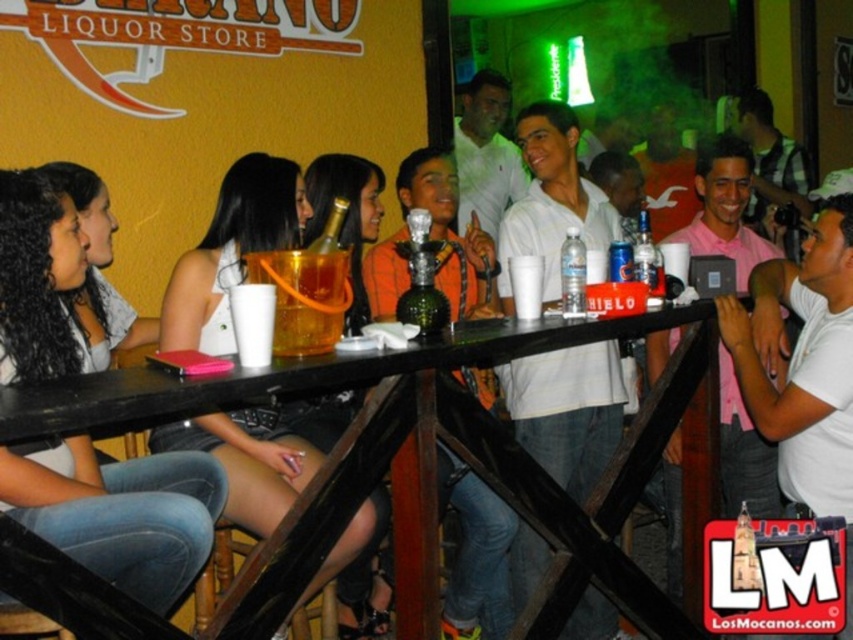
How far apart are translucent plastic cup at center and clear plastic bottle at bar center?

translucent plastic cup at center is 27.66 inches from clear plastic bottle at bar center.

Can you confirm if translucent plastic cup at center is shorter than clear plastic bottle at bar center?

No, translucent plastic cup at center is not shorter than clear plastic bottle at bar center.

What do you see at coordinates (305, 298) in the screenshot?
I see `translucent plastic cup at center` at bounding box center [305, 298].

Image resolution: width=853 pixels, height=640 pixels. Identify the location of translucent plastic cup at center. (305, 298).

Is white matte shirt at center bigger than clear plastic bottle at bar center?

Correct, white matte shirt at center is larger in size than clear plastic bottle at bar center.

Between white matte shirt at center and clear plastic bottle at bar center, which one appears on the left side from the viewer's perspective?

clear plastic bottle at bar center is more to the left.

Locate an element on the screen. white matte shirt at center is located at coordinates (567, 410).

Is point (152, 573) positioned in front of point (567, 355)?

Yes, it is.

Between denim jeans at lower left and white matte shirt at center, which one appears on the left side from the viewer's perspective?

Positioned to the left is denim jeans at lower left.

Is point (20, 490) positioned in front of point (550, 413)?

Yes, point (20, 490) is closer to viewer.

At what (x,y) coordinates should I click in order to perform the action: click on denim jeans at lower left. Please return your answer as a coordinate pair (x, y). The height and width of the screenshot is (640, 853). Looking at the image, I should click on (119, 513).